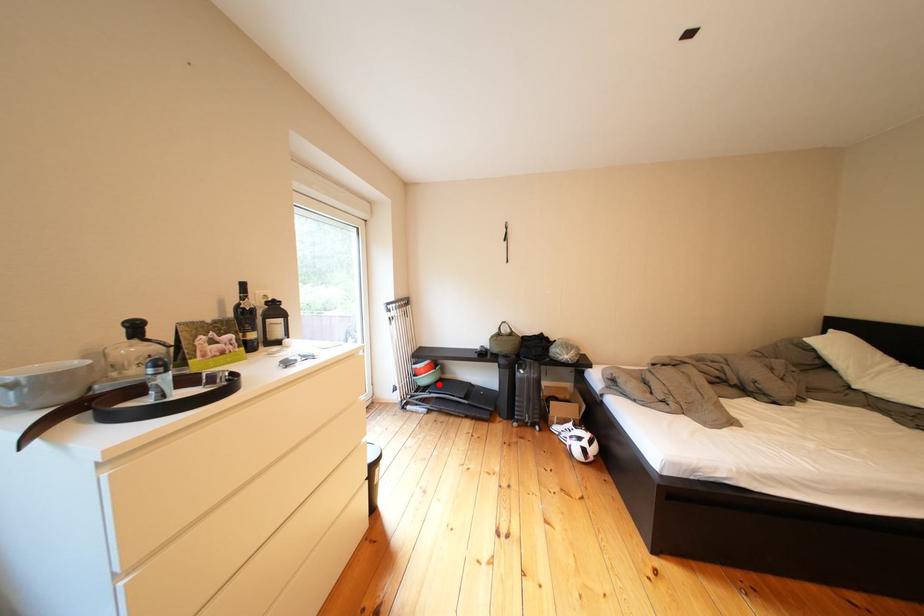
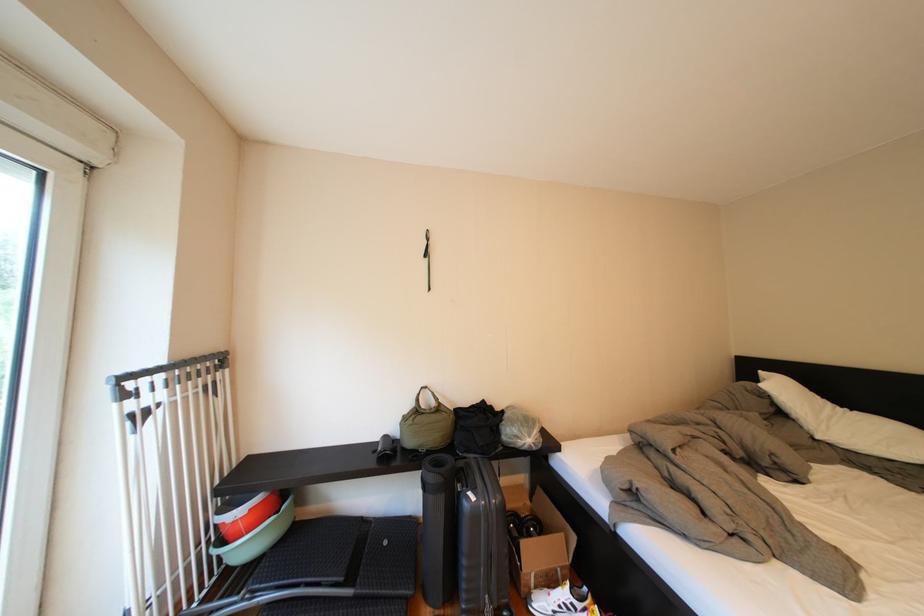
Question: I am providing you with two images of the same scene from different viewpoints. In image1, a red point is highlighted. Considering the same 3D point in image2, which of the following is correct?

Choices:
 (A) It is closer
 (B) It is farther

Answer: (A)